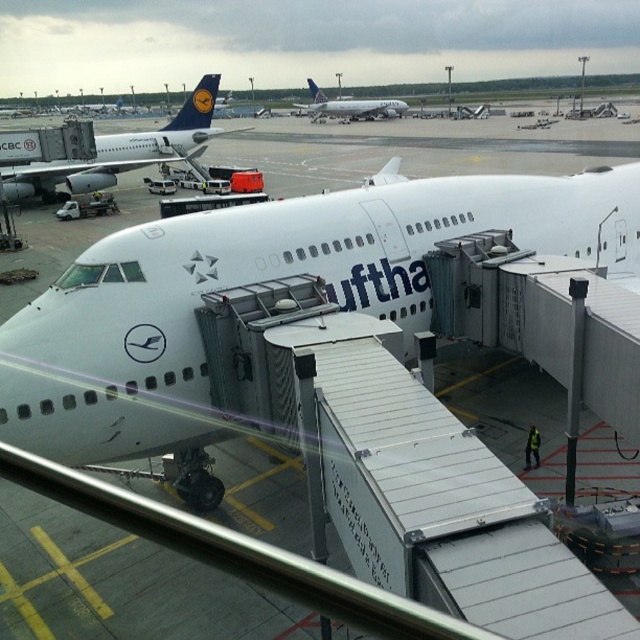
You are a maintenance worker at the airport and need to inspect both the white matte airplane at center and the white glossy airplane at center. Given that your inspection equipment has a maximum range of 100 meters, can you inspect both airplanes without moving the equipment?

The white matte airplane at center is 97.07 meters from the white glossy airplane at center. Since the distance between them is within the 100 meters range of the equipment, you can inspect both airplanes without moving the equipment.

You are an airport maintenance worker who needs to inspect both the white glossy airplane at upper left and the white glossy airplane at center. Which airplane requires a taller ladder for inspection?

The white glossy airplane at upper left requires a taller ladder for inspection because it is larger in size than the white glossy airplane at center.

You are standing at the airport terminal and want to board the white matte airplane at center. The jet bridge you are on is 8 meters long. Can you reach the airplane using this jet bridge?

The white matte airplane at center is 9.29 meters away from the viewer. Since the jet bridge is only 8 meters long, it is not long enough to reach the airplane. You will need a longer jet bridge or a different boarding method.